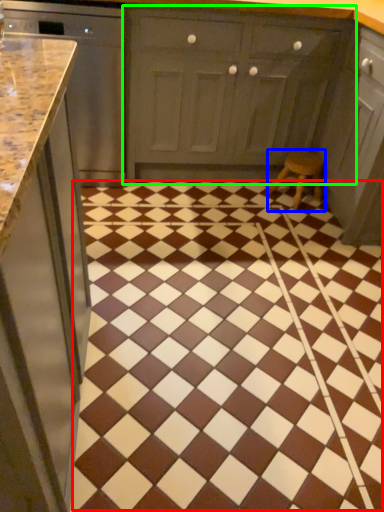
Question: Which is farther away from ceramic tile (highlighted by a red box)? stool (highlighted by a blue box) or cabinetry (highlighted by a green box)?

Choices:
 (A) stool
 (B) cabinetry

Answer: (B)